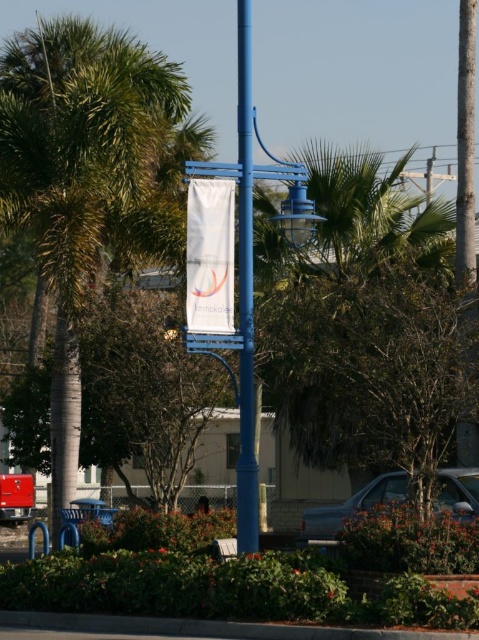
Can you confirm if blue painted metal pole at center is positioned above silver metallic sedan at center?

Yes.

Is blue painted metal pole at center bigger than silver metallic sedan at center?

Yes, blue painted metal pole at center is bigger than silver metallic sedan at center.

Who is more forward, [240,216] or [324,531]?

Point [240,216] is in front.

Locate an element on the screen. This screenshot has height=640, width=479. blue painted metal pole at center is located at coordinates (246, 296).

What do you see at coordinates (246, 296) in the screenshot?
I see `blue painted metal pole at center` at bounding box center [246, 296].

Is blue painted metal pole at center to the left of white fabric banner at center from the viewer's perspective?

In fact, blue painted metal pole at center is to the right of white fabric banner at center.

Does point (237, 496) come in front of point (202, 202)?

That is False.

Where is `blue painted metal pole at center`? This screenshot has width=479, height=640. blue painted metal pole at center is located at coordinates (246, 296).

Is white fabric banner at center shorter than silver metallic sedan at center?

In fact, white fabric banner at center may be taller than silver metallic sedan at center.

Does white fabric banner at center have a lesser width compared to silver metallic sedan at center?

Yes, white fabric banner at center is thinner than silver metallic sedan at center.

Does point (212, 200) come in front of point (454, 513)?

Yes, point (212, 200) is closer to viewer.

Where is `white fabric banner at center`? white fabric banner at center is located at coordinates (209, 257).